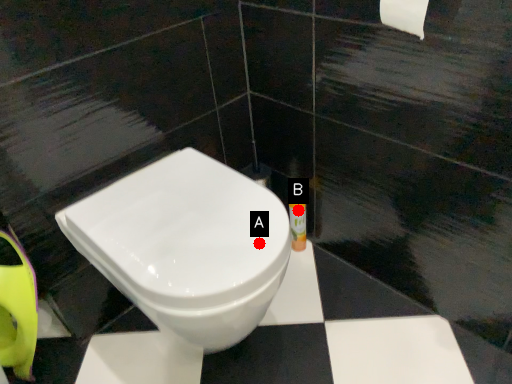
Question: Two points are circled on the image, labeled by A and B beside each circle. Which point is further to the camera?

Choices:
 (A) A is further
 (B) B is further

Answer: (B)